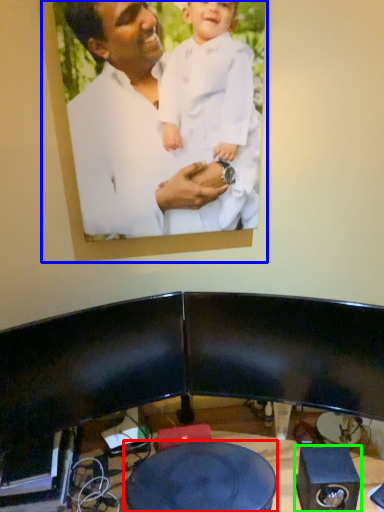
Question: Estimate the real-world distances between objects in this image. Which object is closer to round table (highlighted by a red box), picture frame (highlighted by a blue box) or speaker (highlighted by a green box)?

Choices:
 (A) picture frame
 (B) speaker

Answer: (B)